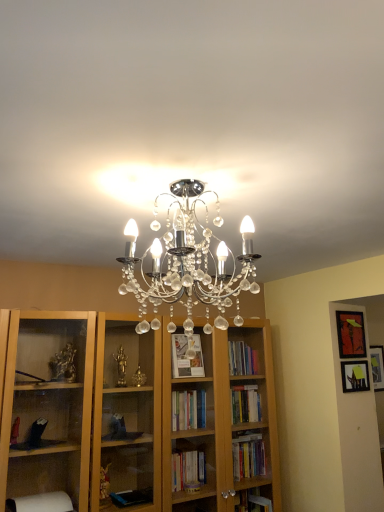
Question: Is there a large distance between matte black picture frame at upper right, placed as the 2th picture frame when sorted from top to bottom, and matte black picture frame at upper right, the 1th picture frame in the top-to-bottom sequence?

Choices:
 (A) no
 (B) yes

Answer: (A)

Question: Is matte black picture frame at upper right, placed as the 2th picture frame when sorted from top to bottom, taller than matte black picture frame at upper right, the 1th picture frame in the top-to-bottom sequence?

Choices:
 (A) yes
 (B) no

Answer: (B)

Question: Does matte black picture frame at upper right, placed as the 2th picture frame when sorted from top to bottom, appear on the left side of matte black picture frame at upper right, arranged as the second picture frame when ordered from the bottom?

Choices:
 (A) yes
 (B) no

Answer: (A)

Question: Is matte black picture frame at upper right, the first picture frame in the bottom-to-top sequence, wider than matte black picture frame at upper right, arranged as the second picture frame when ordered from the bottom?

Choices:
 (A) no
 (B) yes

Answer: (A)

Question: Does matte black picture frame at upper right, the first picture frame in the bottom-to-top sequence, have a lesser width compared to matte black picture frame at upper right, arranged as the second picture frame when ordered from the bottom?

Choices:
 (A) yes
 (B) no

Answer: (A)

Question: Can you confirm if matte black picture frame at upper right, the first picture frame in the bottom-to-top sequence, is shorter than matte black picture frame at upper right, the 1th picture frame in the top-to-bottom sequence?

Choices:
 (A) yes
 (B) no

Answer: (A)

Question: Does matte black picture frame at upper right, the 1th picture frame in the top-to-bottom sequence, have a lesser height compared to matte black picture frame at upper right, the first picture frame in the bottom-to-top sequence?

Choices:
 (A) yes
 (B) no

Answer: (B)

Question: Is there a large distance between matte black picture frame at upper right, the 1th picture frame in the top-to-bottom sequence, and matte black picture frame at upper right, the first picture frame in the bottom-to-top sequence?

Choices:
 (A) no
 (B) yes

Answer: (A)

Question: Can you confirm if matte black picture frame at upper right, arranged as the second picture frame when ordered from the bottom, is positioned to the left of matte black picture frame at upper right, the first picture frame in the bottom-to-top sequence?

Choices:
 (A) yes
 (B) no

Answer: (B)

Question: Is matte black picture frame at upper right, arranged as the second picture frame when ordered from the bottom, outside of matte black picture frame at upper right, the first picture frame in the bottom-to-top sequence?

Choices:
 (A) no
 (B) yes

Answer: (B)

Question: Does matte black picture frame at upper right, the 1th picture frame in the top-to-bottom sequence, have a greater height compared to matte black picture frame at upper right, the first picture frame in the bottom-to-top sequence?

Choices:
 (A) yes
 (B) no

Answer: (A)

Question: From the image's perspective, is matte black picture frame at upper right, the 1th picture frame in the top-to-bottom sequence, located beneath matte black picture frame at upper right, the first picture frame in the bottom-to-top sequence?

Choices:
 (A) yes
 (B) no

Answer: (B)

Question: From the image's perspective, is matte black picture frame at upper right, the 1th picture frame in the top-to-bottom sequence, above or below matte black picture frame at upper right, the first picture frame in the bottom-to-top sequence?

Choices:
 (A) below
 (B) above

Answer: (B)